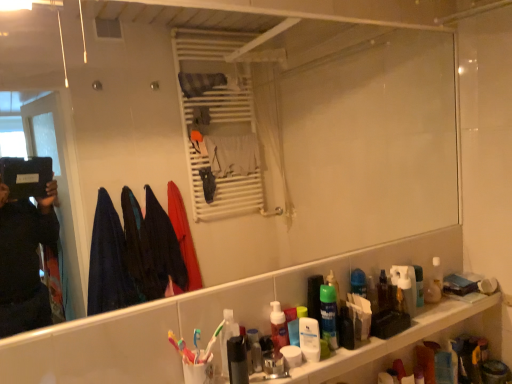
Measure the distance between point (417, 287) and camera.

Point (417, 287) and camera are 5.22 feet apart from each other.

Describe the element at coordinates (360, 315) in the screenshot. The width and height of the screenshot is (512, 384). I see `white matte toothpaste at center` at that location.

Image resolution: width=512 pixels, height=384 pixels. Describe the element at coordinates (329, 315) in the screenshot. I see `green matte mouthwash at right, the 4th mouthwash positioned from the right` at that location.

The height and width of the screenshot is (384, 512). What do you see at coordinates (180, 347) in the screenshot?
I see `multicolored plastic toothbrush at lower center, placed as the 2th toothbrush when sorted from right to left` at bounding box center [180, 347].

Locate an element on the screen. The image size is (512, 384). translucent plastic cup at lower center is located at coordinates (255, 350).

Considering the relative positions of green matte mouthwash at right, which appears as the 4th mouthwash when viewed from the front, and translucent plastic mouthwash at right, the 1th mouthwash in the back-to-front sequence, in the image provided, is green matte mouthwash at right, which appears as the 4th mouthwash when viewed from the front, to the right of translucent plastic mouthwash at right, the 1th mouthwash in the back-to-front sequence, from the viewer's perspective?

In fact, green matte mouthwash at right, which appears as the 4th mouthwash when viewed from the front, is to the left of translucent plastic mouthwash at right, the 1th mouthwash in the back-to-front sequence.

Does point (324, 303) appear closer or farther from the camera than point (438, 277)?

Point (324, 303) is closer to the camera than point (438, 277).

From a real-world perspective, between green matte mouthwash at right, the 4th mouthwash positioned from the right, and translucent plastic mouthwash at right, the 1th mouthwash in the back-to-front sequence, who is vertically higher?

green matte mouthwash at right, the 4th mouthwash positioned from the right, is physically above.

In order to click on the 3rd mouthwash above when counting from the green matte mouthwash at right, which is the 4th mouthwash from left to right (from the image's perspective) in this screenshot , I will do `click(434, 283)`.

Considering the relative sizes of translucent plastic mouthwash at right, the 1th mouthwash positioned from the right, and multicolored plastic toothbrush at lower center, placed as the 2th toothbrush when sorted from right to left, in the image provided, is translucent plastic mouthwash at right, the 1th mouthwash positioned from the right, smaller than multicolored plastic toothbrush at lower center, placed as the 2th toothbrush when sorted from right to left,?

No.

From the image's perspective, is translucent plastic mouthwash at right, the 1th mouthwash positioned from the right, located above or below multicolored plastic toothbrush at lower center, placed as the 2th toothbrush when sorted from right to left?

translucent plastic mouthwash at right, the 1th mouthwash positioned from the right, is above multicolored plastic toothbrush at lower center, placed as the 2th toothbrush when sorted from right to left.

Considering the points (433, 284) and (184, 358), which point is in front, point (433, 284) or point (184, 358)?

Positioned in front is point (184, 358).

How different are the orientations of translucent plastic mouthwash at shelf center, positioned as the sixth mouthwash in back-to-front order, and white matte toothpaste at center in degrees?

They differ by 0.000889 degrees in their facing directions.

Is translucent plastic mouthwash at shelf center, the seventh mouthwash from the right, in front of white matte toothpaste at center?

Yes, translucent plastic mouthwash at shelf center, the seventh mouthwash from the right, is in front of white matte toothpaste at center.

Is translucent plastic mouthwash at shelf center, the 2th mouthwash viewed from the front, taller or shorter than white matte toothpaste at center?

In the image, translucent plastic mouthwash at shelf center, the 2th mouthwash viewed from the front, appears to be taller than white matte toothpaste at center.

Is translucent plastic mouthwash at shelf center, the seventh mouthwash from the right, positioned with its back to white matte toothpaste at center?

No, white matte toothpaste at center is not at the back of translucent plastic mouthwash at shelf center, the seventh mouthwash from the right.

Does translucent plastic toothbrush at lower center, the 2th toothbrush viewed from the left, contain translucent plastic cup at lower center?

No, translucent plastic cup at lower center is located outside of translucent plastic toothbrush at lower center, the 2th toothbrush viewed from the left.

Considering the relative sizes of translucent plastic toothbrush at lower center, the first toothbrush when ordered from right to left, and translucent plastic cup at lower center in the image provided, is translucent plastic toothbrush at lower center, the first toothbrush when ordered from right to left, wider than translucent plastic cup at lower center?

In fact, translucent plastic toothbrush at lower center, the first toothbrush when ordered from right to left, might be narrower than translucent plastic cup at lower center.

This screenshot has height=384, width=512. What are the coordinates of `toiletry on the right side of translucent plastic toothbrush at lower center, the first toothbrush when ordered from right to left` in the screenshot? It's located at (255, 350).

From a real-world perspective, is translucent plastic cup at lower center physically below clear plastic mouthwash at right, placed as the second mouthwash when sorted from back to front?

Yes, from a real-world perspective, translucent plastic cup at lower center is under clear plastic mouthwash at right, placed as the second mouthwash when sorted from back to front.

Considering the relative positions of translucent plastic cup at lower center and clear plastic mouthwash at right, placed as the second mouthwash when sorted from back to front, in the image provided, is translucent plastic cup at lower center to the left of clear plastic mouthwash at right, placed as the second mouthwash when sorted from back to front, from the viewer's perspective?

Correct, you'll find translucent plastic cup at lower center to the left of clear plastic mouthwash at right, placed as the second mouthwash when sorted from back to front.

Locate an element on the screen. the 6th mouthwash above the translucent plastic cup at lower center (from the image's perspective) is located at coordinates (419, 286).

Relative to clear plastic mouthwash at right, which appears as the 2th mouthwash when viewed from the right, is translucent plastic cup at lower center in front or behind?

Clearly, translucent plastic cup at lower center is in front of clear plastic mouthwash at right, which appears as the 2th mouthwash when viewed from the right.

Between translucent plastic mouthwash at shelf center, marked as the 5th mouthwash in a back-to-front arrangement, and translucent plastic mouthwash at shelf center, which ranks as the first mouthwash in left-to-right order, which one appears on the right side from the viewer's perspective?

Positioned to the right is translucent plastic mouthwash at shelf center, marked as the 5th mouthwash in a back-to-front arrangement.

Is translucent plastic mouthwash at shelf center, arranged as the sixth mouthwash when viewed from the right, facing towards translucent plastic mouthwash at shelf center, the 2th mouthwash viewed from the front?

No, translucent plastic mouthwash at shelf center, arranged as the sixth mouthwash when viewed from the right, is not aimed at translucent plastic mouthwash at shelf center, the 2th mouthwash viewed from the front.

Can you confirm if translucent plastic mouthwash at shelf center, the second mouthwash viewed from the left, is shorter than translucent plastic mouthwash at shelf center, which ranks as the first mouthwash in left-to-right order?

Correct, translucent plastic mouthwash at shelf center, the second mouthwash viewed from the left, is not as tall as translucent plastic mouthwash at shelf center, which ranks as the first mouthwash in left-to-right order.

Is point (294, 327) behind point (274, 336)?

No, it is not.

From the picture: Can we say clear plastic mouthwash at right, placed as the 6th mouthwash when sorted from front to back, lies outside multicolored plastic toothbrush at lower center, acting as the first toothbrush starting from the left?

clear plastic mouthwash at right, placed as the 6th mouthwash when sorted from front to back, is positioned outside multicolored plastic toothbrush at lower center, acting as the first toothbrush starting from the left.

Between clear plastic mouthwash at right, placed as the 6th mouthwash when sorted from left to right, and multicolored plastic toothbrush at lower center, placed as the 2th toothbrush when sorted from right to left, which one has more height?

clear plastic mouthwash at right, placed as the 6th mouthwash when sorted from left to right, is taller.

From a real-world perspective, is clear plastic mouthwash at right, placed as the 6th mouthwash when sorted from left to right, located higher than multicolored plastic toothbrush at lower center, acting as the first toothbrush starting from the left?

No, from a real-world perspective, clear plastic mouthwash at right, placed as the 6th mouthwash when sorted from left to right, is not on top of multicolored plastic toothbrush at lower center, acting as the first toothbrush starting from the left.

At what (x,y) coordinates should I click in order to perform the action: click on the 3rd mouthwash in front when counting from the translucent plastic mouthwash at right, marked as the seventh mouthwash in a front-to-back arrangement. Please return your answer as a coordinate pair (x, y). The image size is (512, 384). Looking at the image, I should click on (329, 315).

The height and width of the screenshot is (384, 512). I want to click on toothbrush that is the 2nd one when counting leftward from the translucent plastic mouthwash at right, marked as the seventh mouthwash in a front-to-back arrangement, so click(180, 347).

Considering their positions, is clear plastic mouthwash at right, which appears as the 2th mouthwash when viewed from the right, positioned closer to white plastic mouthwash at lower center, which is counted as the first mouthwash, starting from the front, than translucent plastic mouthwash at shelf center, the seventh mouthwash from the right?

Among the two, translucent plastic mouthwash at shelf center, the seventh mouthwash from the right, is located nearer to white plastic mouthwash at lower center, which is counted as the first mouthwash, starting from the front.

When comparing their distances from translucent plastic shelf at lower right, does white matte toothpaste at center or white plastic mouthwash at lower center, which is counted as the first mouthwash, starting from the front, seem closer?

white matte toothpaste at center.

Based on their spatial positions, is clear plastic mouthwash at right, placed as the second mouthwash when sorted from back to front, or translucent plastic mouthwash at right, the 1th mouthwash positioned from the right, closer to translucent plastic mouthwash at shelf center, the seventh mouthwash from the right?

The object closer to translucent plastic mouthwash at shelf center, the seventh mouthwash from the right, is clear plastic mouthwash at right, placed as the second mouthwash when sorted from back to front.

Which object lies nearer to the anchor point translucent plastic toothbrush at lower center, the 2th toothbrush viewed from the left, translucent plastic mouthwash at shelf center, the 2th mouthwash viewed from the front, or green matte mouthwash at right, the 4th mouthwash positioned from the right?

translucent plastic mouthwash at shelf center, the 2th mouthwash viewed from the front.

From the image, which object appears to be nearer to green matte mouthwash at right, which is the 4th mouthwash from left to right, translucent plastic toothbrush at lower center, the first toothbrush when ordered from right to left, or translucent plastic shelf at lower right?

The object closer to green matte mouthwash at right, which is the 4th mouthwash from left to right, is translucent plastic shelf at lower right.

When comparing their distances from green matte mouthwash at right, which is the 4th mouthwash from left to right, does translucent plastic mouthwash at shelf center, positioned as the sixth mouthwash in back-to-front order, or translucent plastic cup at lower center seem closer?

Among the two, translucent plastic mouthwash at shelf center, positioned as the sixth mouthwash in back-to-front order, is located nearer to green matte mouthwash at right, which is the 4th mouthwash from left to right.

Based on their spatial positions, is brown plastic bottle at lower right, the 5th mouthwash viewed from the front, or multicolored plastic toothbrush at lower center, placed as the 2th toothbrush when sorted from right to left, further from white matte toothpaste at center?

Based on the image, multicolored plastic toothbrush at lower center, placed as the 2th toothbrush when sorted from right to left, appears to be further to white matte toothpaste at center.

When comparing their distances from translucent plastic mouthwash at right, placed as the seventh mouthwash when sorted from left to right, does white matte toothpaste at center or translucent plastic mouthwash at shelf center, positioned as the sixth mouthwash in back-to-front order, seem further?

Based on the image, translucent plastic mouthwash at shelf center, positioned as the sixth mouthwash in back-to-front order, appears to be further to translucent plastic mouthwash at right, placed as the seventh mouthwash when sorted from left to right.

Identify the location of toiletry located between multicolored plastic toothbrush at lower center, acting as the first toothbrush starting from the left, and white matte toothpaste at center in the left-right direction. The height and width of the screenshot is (384, 512). (255, 350).

The image size is (512, 384). Find the location of `toothbrush situated between multicolored plastic toothbrush at lower center, placed as the 2th toothbrush when sorted from right to left, and white plastic mouthwash at lower center, marked as the third mouthwash in a left-to-right arrangement, from left to right`. toothbrush situated between multicolored plastic toothbrush at lower center, placed as the 2th toothbrush when sorted from right to left, and white plastic mouthwash at lower center, marked as the third mouthwash in a left-to-right arrangement, from left to right is located at coordinates (211, 343).

Identify the location of toiletry between multicolored plastic toothbrush at lower center, acting as the first toothbrush starting from the left, and translucent plastic shelf at lower right. (255, 350).

The height and width of the screenshot is (384, 512). I want to click on toothpaste situated between translucent plastic toothbrush at lower center, the first toothbrush when ordered from right to left, and translucent plastic shelf at lower right from left to right, so click(360, 315).